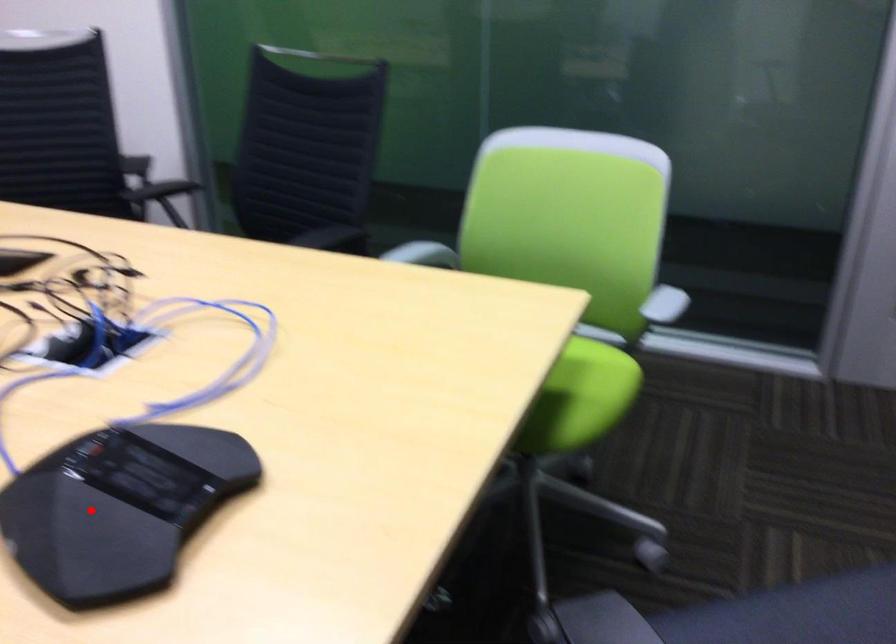
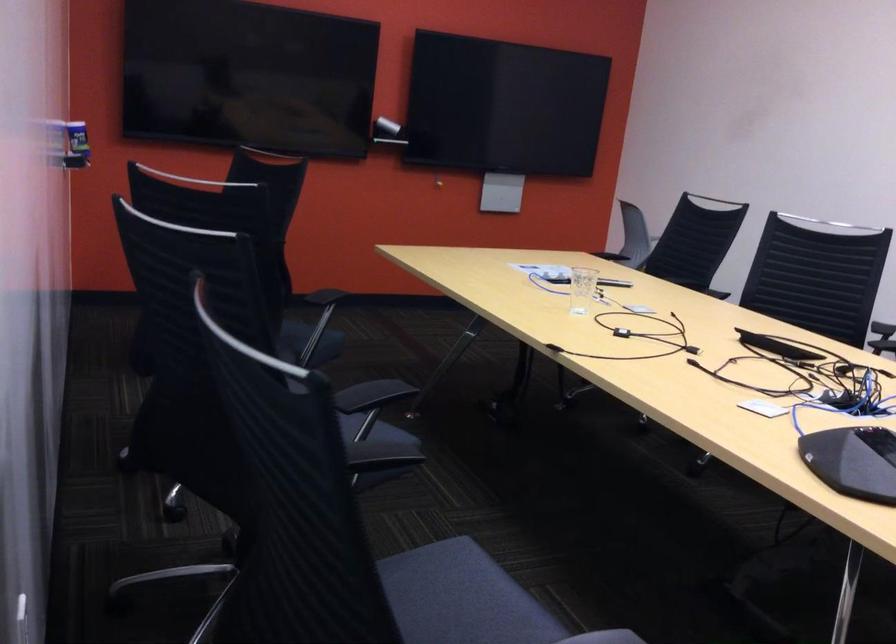
Locate, in the second image, the point that corresponds to the highlighted location in the first image.

(853, 460)